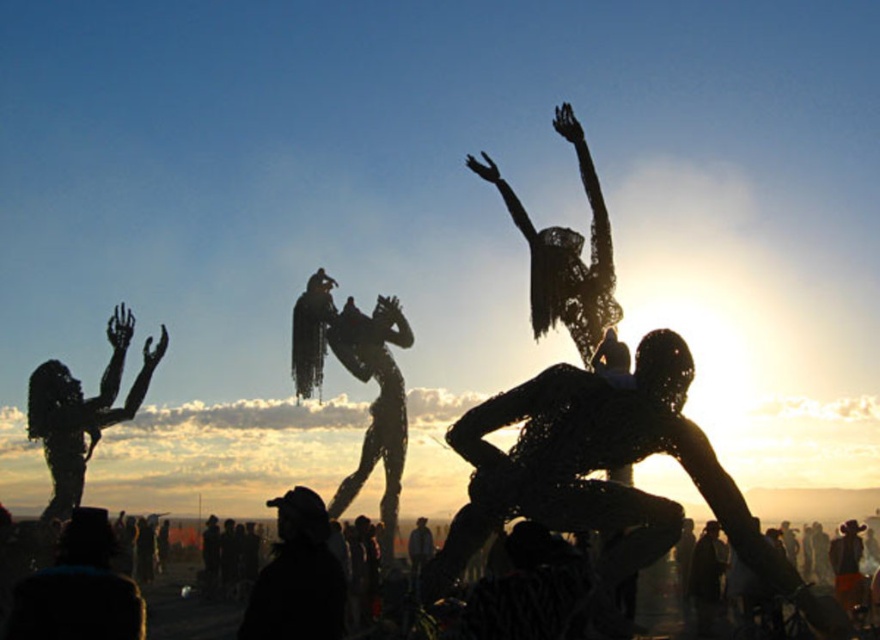
Question: Among these points, which one is nearest to the camera?

Choices:
 (A) (185, 604)
 (B) (264, 595)
 (C) (312, 372)
 (D) (99, 400)

Answer: (B)

Question: Is silvery metallic dancer at upper right wider than silvery wire sculpture at left?

Choices:
 (A) no
 (B) yes

Answer: (B)

Question: Considering the real-world distances, which object is closest to the black fabric crowd at lower left?

Choices:
 (A) silvery metallic dancer at upper right
 (B) silvery wire sculpture at left

Answer: (B)

Question: Is metallic wire sculpture at center to the right of black fabric hat at lower center from the viewer's perspective?

Choices:
 (A) no
 (B) yes

Answer: (B)

Question: Is silvery wire sculpture at left positioned in front of black fabric crowd at lower left?

Choices:
 (A) no
 (B) yes

Answer: (A)

Question: Which object is closer to the camera taking this photo?

Choices:
 (A) silvery wire sculpture at left
 (B) silvery metallic dancer at upper right
 (C) metallic wire sculpture at center
 (D) black fabric crowd at lower left

Answer: (D)